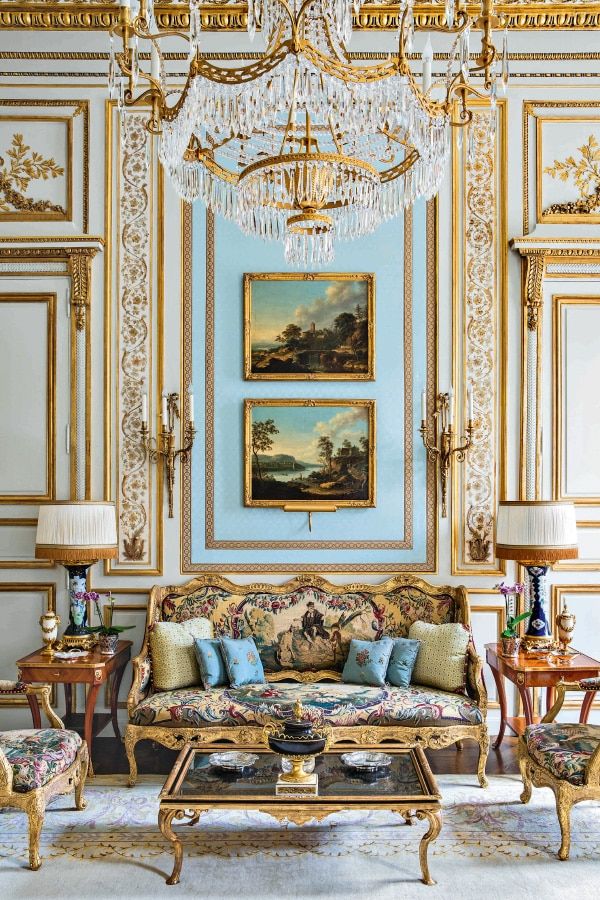
Locate an element on the screen. The width and height of the screenshot is (600, 900). lamp is located at coordinates (547, 551), (80, 574).